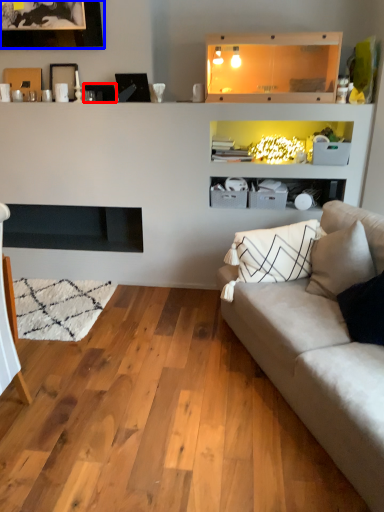
Question: Among these objects, which one is nearest to the camera, picture frame (highlighted by a red box) or picture frame (highlighted by a blue box)?

Choices:
 (A) picture frame
 (B) picture frame

Answer: (B)